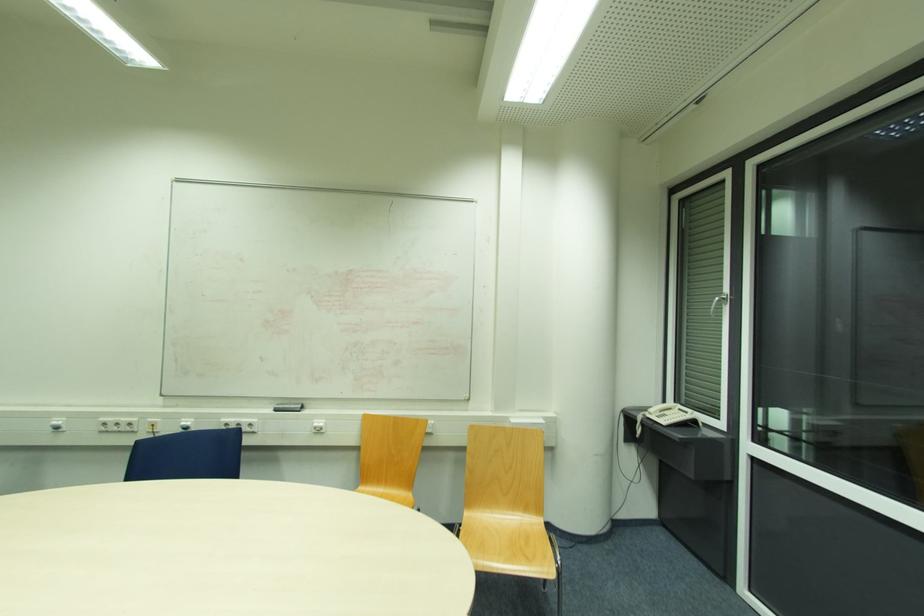
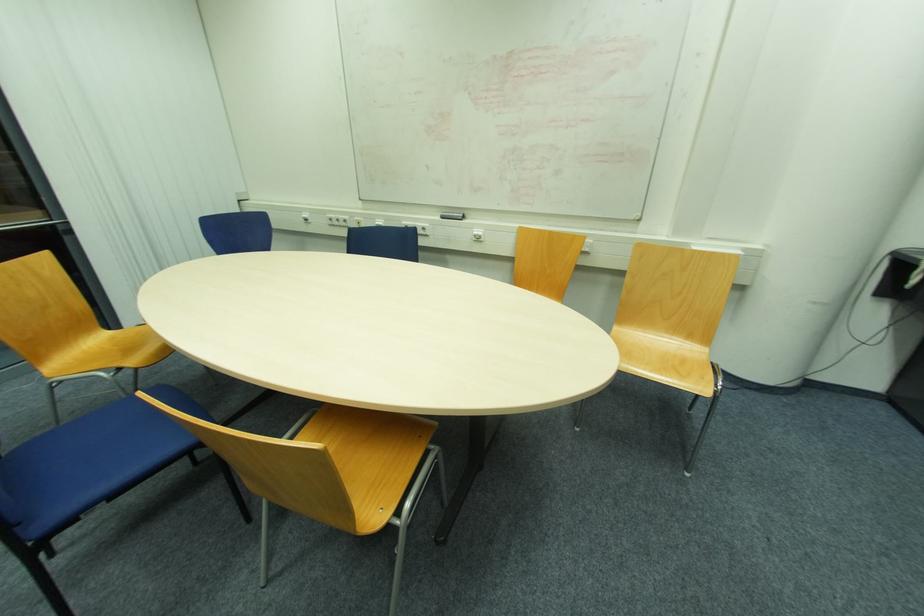
The first image is from the beginning of the video and the second image is from the end. How did the camera likely rotate when shooting the video?

The camera rotated toward left-down.